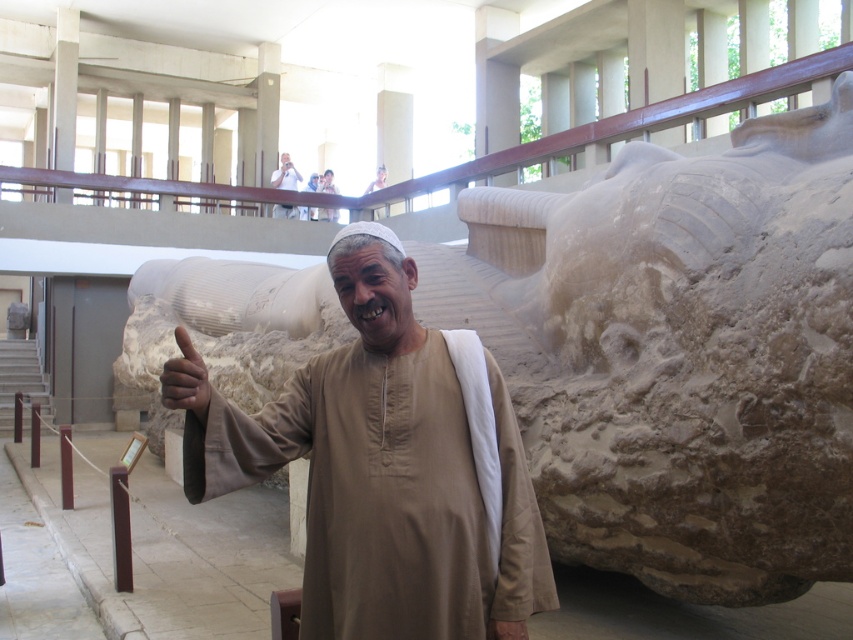
Question: Estimate the real-world distances between objects in this image. Which object is farther from the white cotton robe at center?

Choices:
 (A) dark brown skin at thumb right
 (B) brown matte shirt at center
 (C) matte beige statue at upper center

Answer: (A)

Question: Can you confirm if brown matte shirt at center is positioned below white cotton robe at center?

Choices:
 (A) no
 (B) yes

Answer: (B)

Question: Can you confirm if brown matte shirt at center is smaller than dark brown skin at thumb right?

Choices:
 (A) yes
 (B) no

Answer: (B)

Question: Which point is farther from the camera taking this photo?

Choices:
 (A) (285, 188)
 (B) (329, 220)

Answer: (A)

Question: Which object is the farthest from the matte beige statue at upper center?

Choices:
 (A) white cotton robe at center
 (B) brown matte shirt at center
 (C) dark brown skin at thumb right

Answer: (C)

Question: Is matte beige statue at upper center smaller than white cotton robe at center?

Choices:
 (A) yes
 (B) no

Answer: (B)